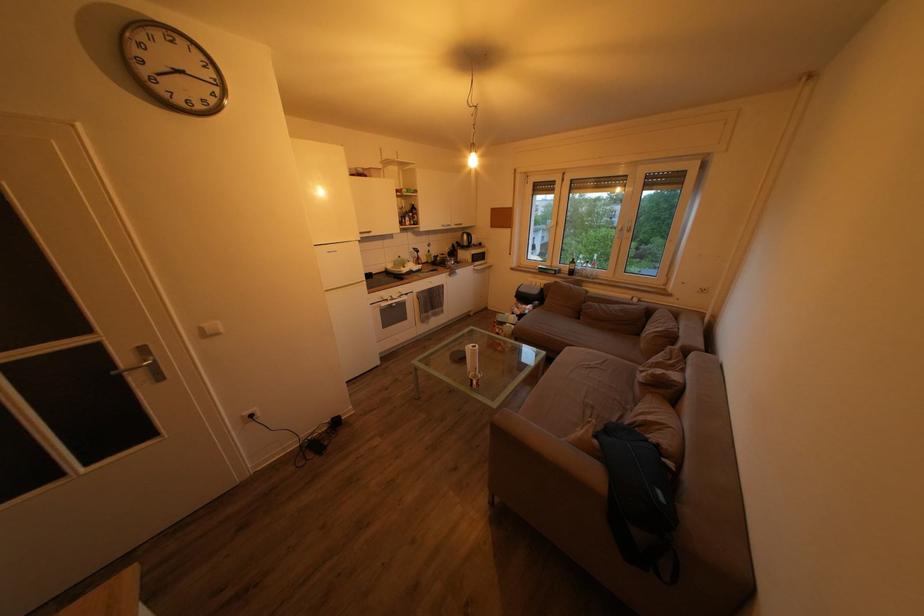
The image size is (924, 616). I want to click on sofa sitting surface, so click(x=635, y=389).